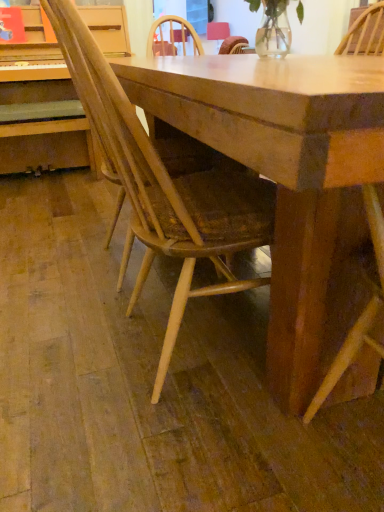
The width and height of the screenshot is (384, 512). Describe the element at coordinates (163, 187) in the screenshot. I see `light brown wooden chair at center` at that location.

Find the location of `light brown wooden chair at center`. light brown wooden chair at center is located at coordinates (163, 187).

Locate an element on the screen. The height and width of the screenshot is (512, 384). light brown wooden chair at center is located at coordinates (163, 187).